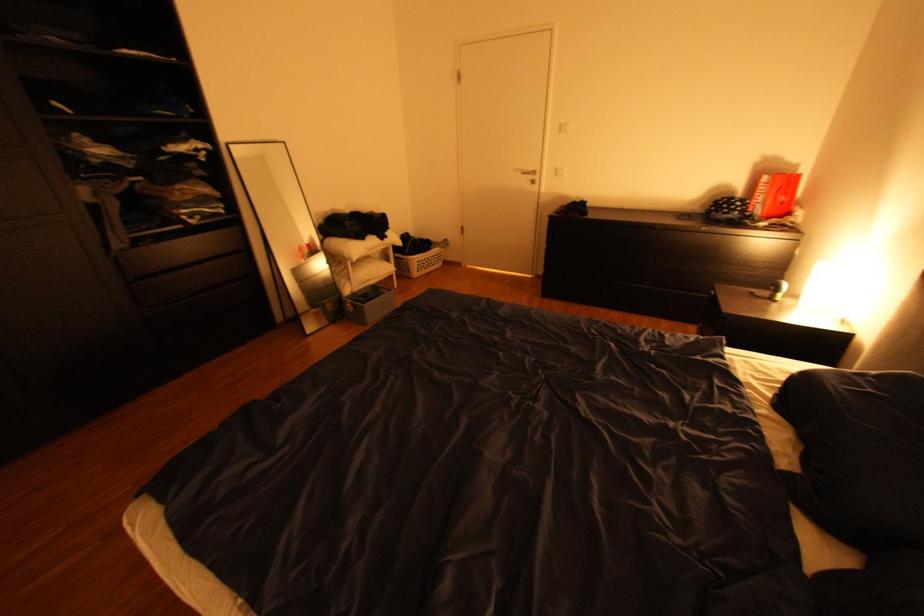
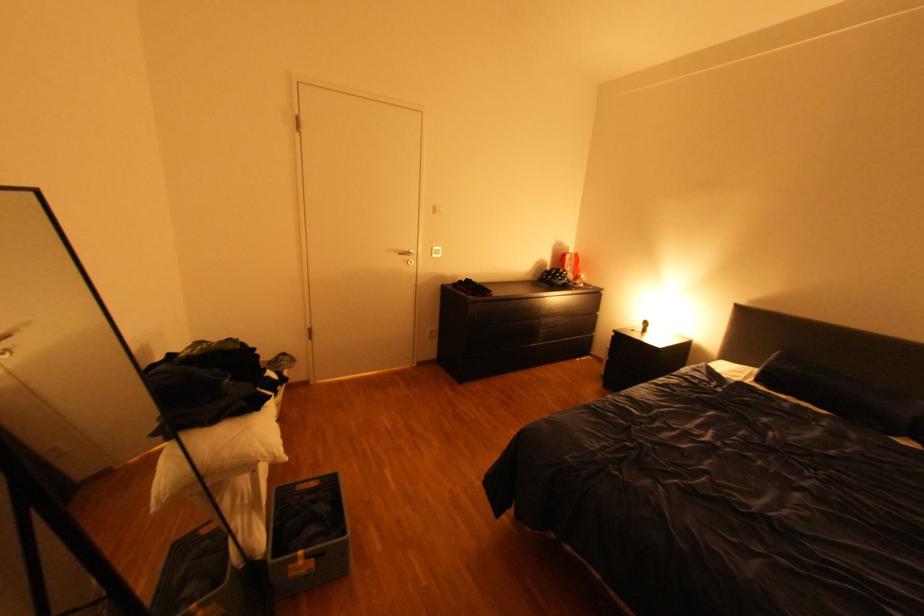
In the second image, find the point that corresponds to the point at 391,290 in the first image.

(310, 488)